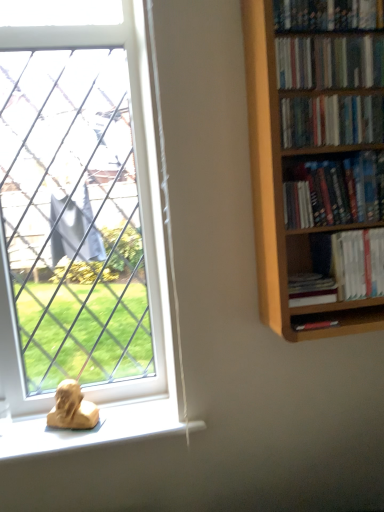
Question: Is hardcover books at upper right, the 1th book positioned from the top, taller or shorter than white paperbacks at center-right, which is counted as the fifth book, starting from the top?

Choices:
 (A) tall
 (B) short

Answer: (B)

Question: Is hardcover books at upper right, the 1th book positioned from the top, situated inside white paperbacks at center-right, which is counted as the fifth book, starting from the top, or outside?

Choices:
 (A) inside
 (B) outside

Answer: (B)

Question: Which object is positioned farthest from the white paperbacks at center-right, the second book when ordered from bottom to top?

Choices:
 (A) hardcover books at upper right, which is counted as the 6th book, starting from the bottom
 (B) hardcover books at upper right, the fourth book positioned from the top
 (C) hardcover books at upper right, positioned as the 2th book in top-to-bottom order
 (D) hardcover book at right, arranged as the sixth book when viewed from the top
 (E) white plastic window at lower left

Answer: (E)

Question: Which object is the closest to the hardcover books at upper right, the 1th book positioned from the top?

Choices:
 (A) white paperbacks at center-right, which is counted as the fifth book, starting from the top
 (B) matte yellow sculpture at lower left
 (C) wooden bookcase at right
 (D) hardcover books at upper right, the fourth book positioned from the top
 (E) hardcover book at right, arranged as the sixth book when viewed from the top

Answer: (C)